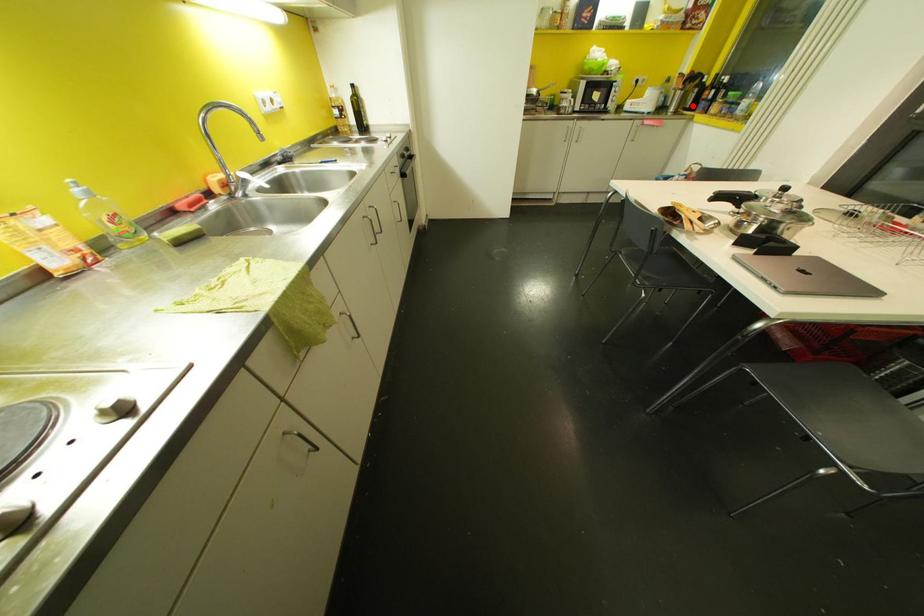
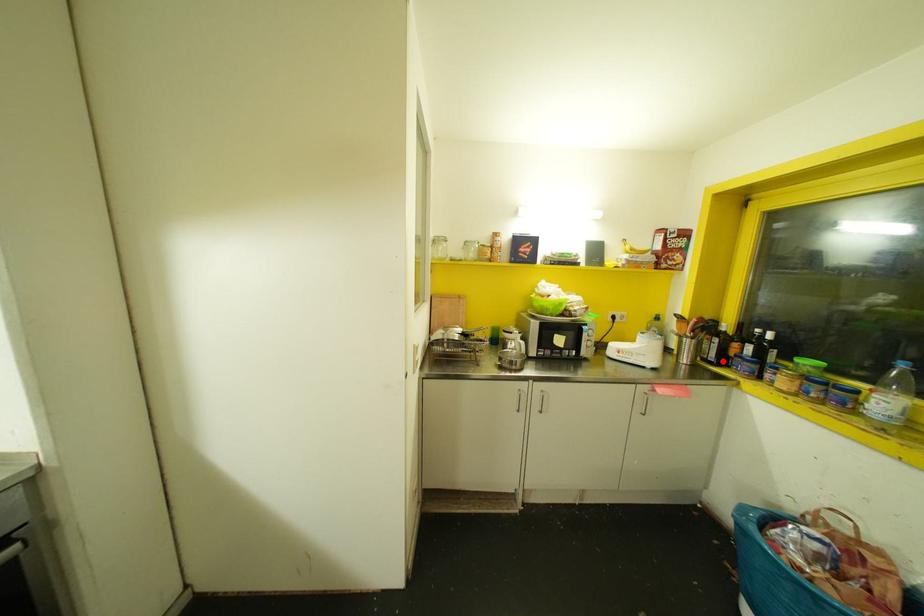
I am providing you with two images of the same scene from different viewpoints. A red point is marked on the first image and another point is marked on the second image. Is the marked point in image1 the same physical position as the marked point in image2?

Yes